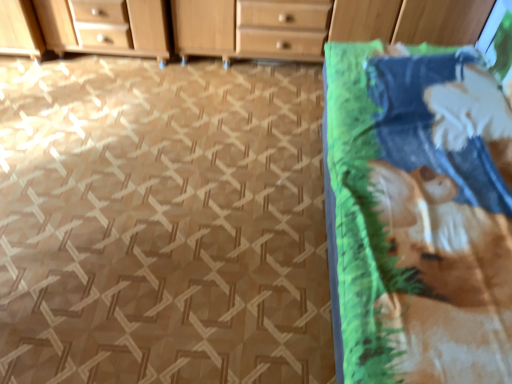
Question: From a real-world perspective, is printed cotton blanket at right beneath green fabric at right?

Choices:
 (A) yes
 (B) no

Answer: (B)

Question: Is printed cotton blanket at right turned away from green fabric at right?

Choices:
 (A) yes
 (B) no

Answer: (B)

Question: Would you say printed cotton blanket at right contains green fabric at right?

Choices:
 (A) no
 (B) yes

Answer: (A)

Question: Is printed cotton blanket at right far from green fabric at right?

Choices:
 (A) yes
 (B) no

Answer: (B)

Question: From a real-world perspective, is printed cotton blanket at right located higher than green fabric at right?

Choices:
 (A) yes
 (B) no

Answer: (A)

Question: Is wooden chest of drawers at upper center bigger or smaller than green fabric at right?

Choices:
 (A) small
 (B) big

Answer: (B)

Question: From a real-world perspective, relative to green fabric at right, is wooden chest of drawers at upper center vertically above or below?

Choices:
 (A) above
 (B) below

Answer: (A)

Question: In the image, is wooden chest of drawers at upper center on the left side or the right side of green fabric at right?

Choices:
 (A) right
 (B) left

Answer: (A)

Question: Considering the positions of point (310, 39) and point (117, 206), is point (310, 39) closer or farther from the camera than point (117, 206)?

Choices:
 (A) closer
 (B) farther

Answer: (B)

Question: From the image's perspective, relative to wooden chest of drawers at upper center, is printed cotton blanket at right above or below?

Choices:
 (A) below
 (B) above

Answer: (A)

Question: Based on their sizes in the image, would you say printed cotton blanket at right is bigger or smaller than wooden chest of drawers at upper center?

Choices:
 (A) small
 (B) big

Answer: (B)

Question: From a real-world perspective, is printed cotton blanket at right positioned above or below wooden chest of drawers at upper center?

Choices:
 (A) above
 (B) below

Answer: (A)

Question: Visually, is printed cotton blanket at right positioned to the left or to the right of wooden chest of drawers at upper center?

Choices:
 (A) right
 (B) left

Answer: (A)

Question: From a real-world perspective, relative to wooden chest of drawers at upper center, is green fabric at right vertically above or below?

Choices:
 (A) below
 (B) above

Answer: (A)

Question: From the image's perspective, is green fabric at right located above or below wooden chest of drawers at upper center?

Choices:
 (A) below
 (B) above

Answer: (A)